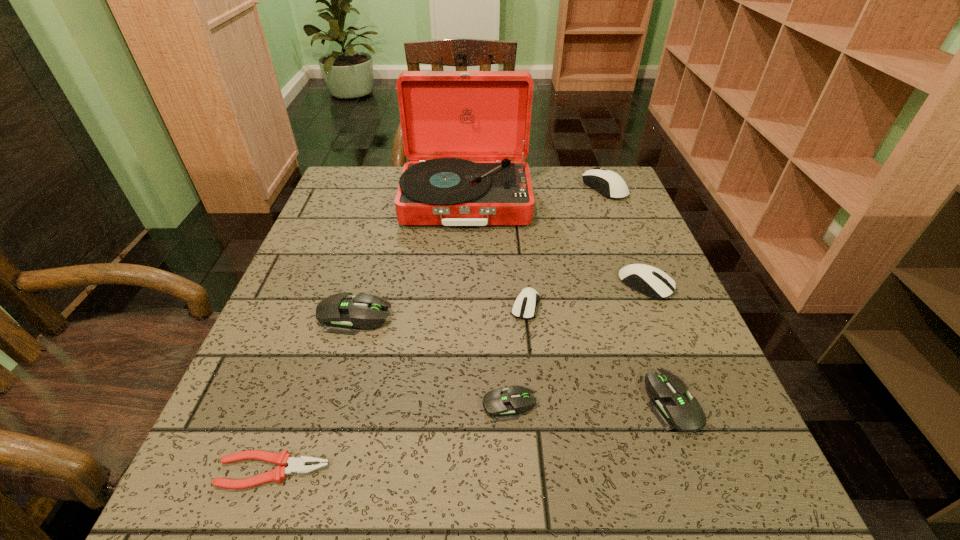
The image size is (960, 540). I want to click on free spot at the right edge of the desktop, so click(x=626, y=265).

This screenshot has height=540, width=960. Find the location of `vacant point at the near left corner`. vacant point at the near left corner is located at coordinates (290, 491).

In the image, there is a desktop. Where is `vacant region at the far right corner`? Image resolution: width=960 pixels, height=540 pixels. vacant region at the far right corner is located at coordinates point(586,187).

The width and height of the screenshot is (960, 540). What are the coordinates of `vacant space at the near right corner of the desktop` in the screenshot? It's located at (687, 531).

The height and width of the screenshot is (540, 960). In order to click on free spot between the shortest computer mouse and the rightmost gray computer mouse in this screenshot , I will do `click(591, 404)`.

Identify the location of vacant area that lies between the tallest object and the rightmost gray computer mouse. This screenshot has height=540, width=960. (570, 303).

At what (x,y) coordinates should I click in order to perform the action: click on vacant space that is in between the second biggest white mouse and the biggest white mouse. Please return your answer as a coordinate pair (x, y). The height and width of the screenshot is (540, 960). Looking at the image, I should click on (625, 237).

Locate an element on the screen. The image size is (960, 540). unoccupied position between the smallest gray computer mouse and the farthest computer mouse is located at coordinates click(557, 296).

Where is `empty space that is in between the pliers and the second smallest gray computer mouse`? empty space that is in between the pliers and the second smallest gray computer mouse is located at coordinates (473, 437).

You are a GUI agent. You are given a task and a screenshot of the screen. Output one action in this format:
    pyautogui.click(x=<x>, y=<y>)
    Task: Click on the blank region between the farthest gray computer mouse and the second smallest white mouse
    The height and width of the screenshot is (540, 960).
    Given the screenshot: What is the action you would take?
    pyautogui.click(x=500, y=301)